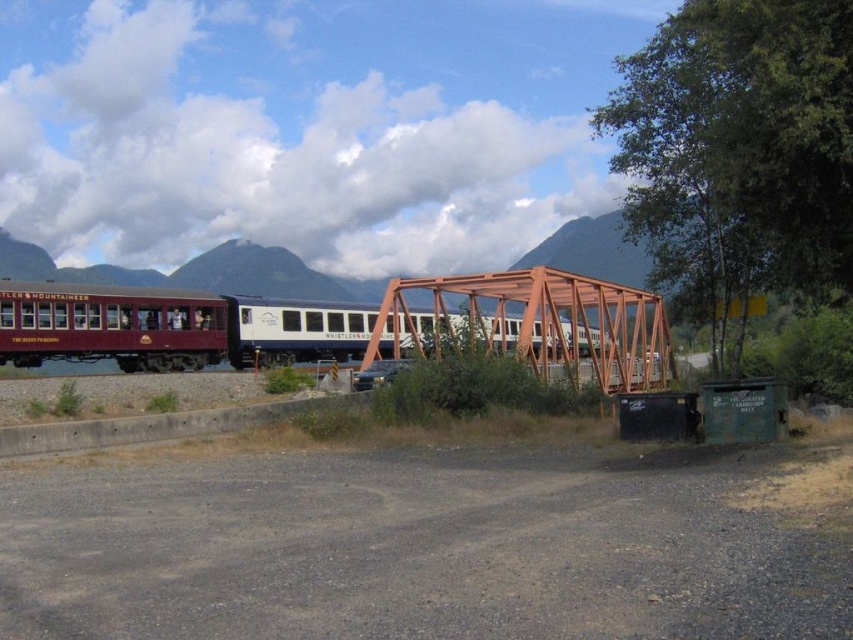
Consider the image. You are a photographer planning to take a photo of the maroon polished wood train car at left and the orange metal bridge at center. Based on their heights, which object should you focus on first if you want to ensure both are in frame without moving the camera?

The orange metal bridge at center is shorter than the maroon polished wood train car at left, so focusing on the taller maroon polished wood train car at left first would allow the shorter bridge to naturally fit into the frame without needing to adjust the camera angle.

You are a photographer planning to take a photo of the maroon polished wood train car at left and the orange metal bridge at center. Based on the scene, which object should you focus on first if you want to capture both in the same frame without moving the camera?

The maroon polished wood train car at left is bigger than the orange metal bridge at center, so you should focus on the maroon polished wood train car at left first to ensure it fills the frame appropriately before adjusting for the bridge.